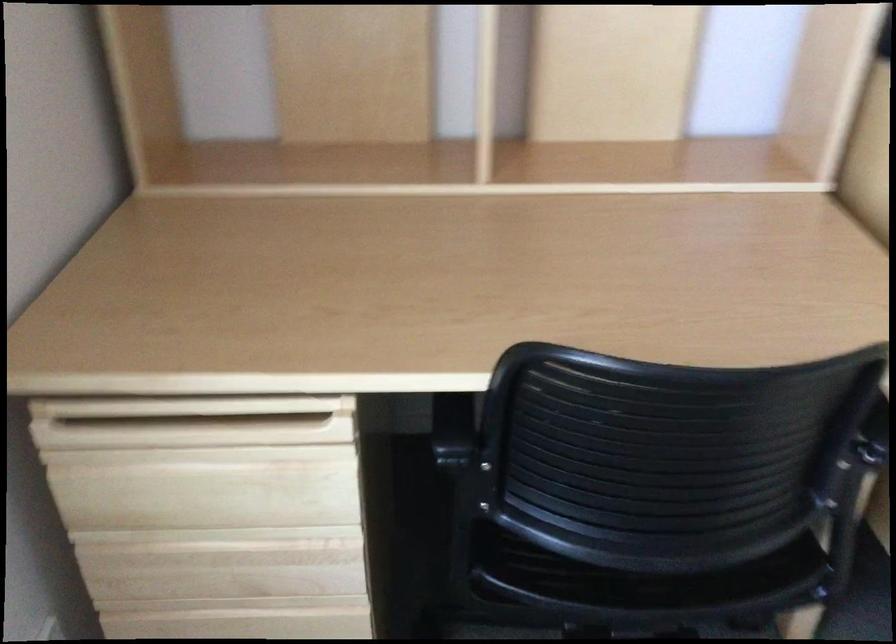
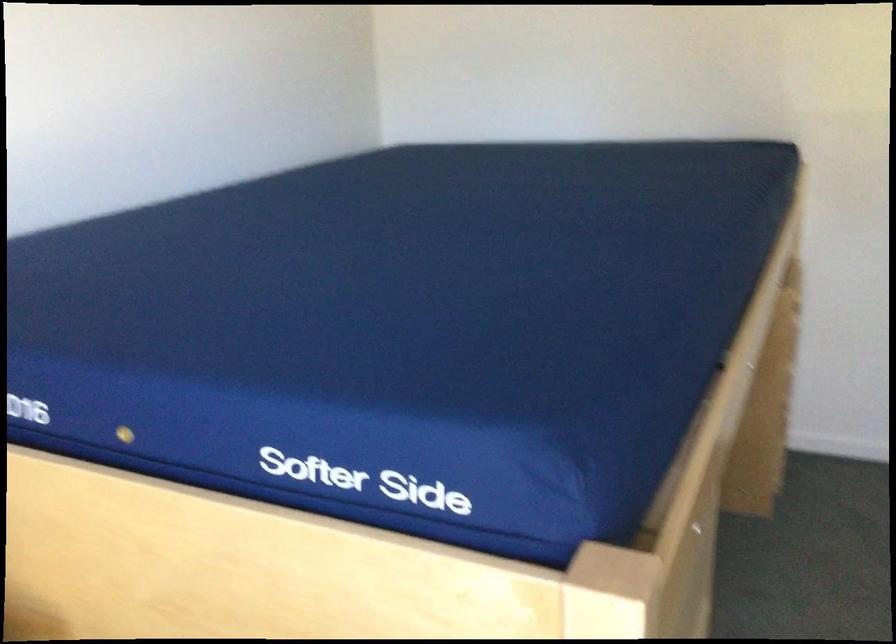
Question: The camera is either moving clockwise (left) or counter-clockwise (right) around the object. The first image is from the beginning of the video and the second image is from the end. Is the camera moving left or right when shooting the video?

Choices:
 (A) Left
 (B) Right

Answer: (A)